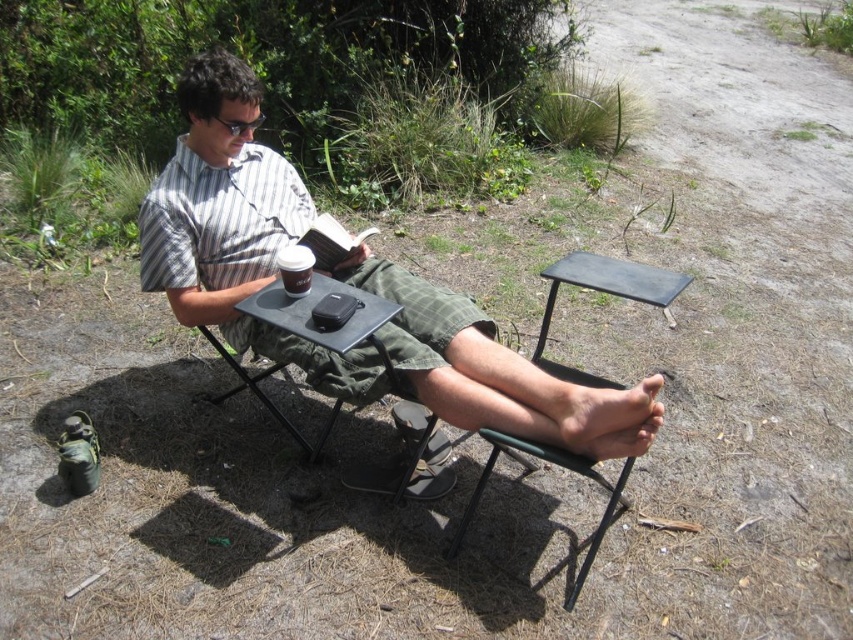
Question: Considering the real-world distances, which object is closest to the white paper cup at center?

Choices:
 (A) hardcover book at center
 (B) metallic black chair at lower center
 (C) matte black phone at center

Answer: (A)

Question: Considering the relative positions of metallic black chair at lower center and white paper cup at center in the image provided, where is metallic black chair at lower center located with respect to white paper cup at center?

Choices:
 (A) left
 (B) right

Answer: (B)

Question: Does matte black phone at center have a larger size compared to white paper cup at center?

Choices:
 (A) no
 (B) yes

Answer: (B)

Question: Which object appears farthest from the camera in this image?

Choices:
 (A) matte black phone at center
 (B) white paper cup at center
 (C) hardcover book at center
 (D) metallic black chair at lower center

Answer: (C)

Question: Is matte black phone at center to the right of metallic black chair at lower center from the viewer's perspective?

Choices:
 (A) yes
 (B) no

Answer: (B)

Question: Which object is positioned closest to the white paper cup at center?

Choices:
 (A) metallic black chair at lower center
 (B) hardcover book at center

Answer: (B)